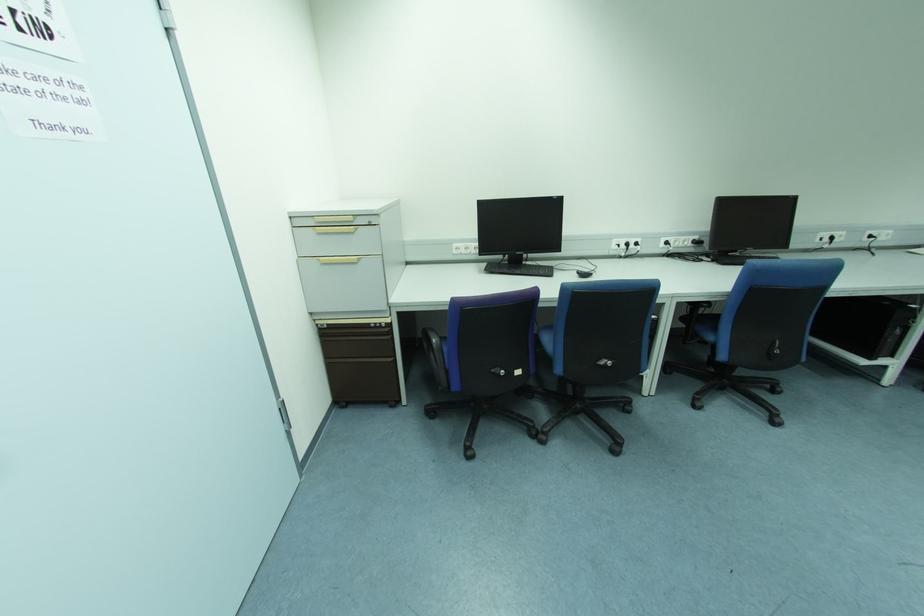
The location [584,273] corresponds to which object?

This point indicates the black computer mouse.